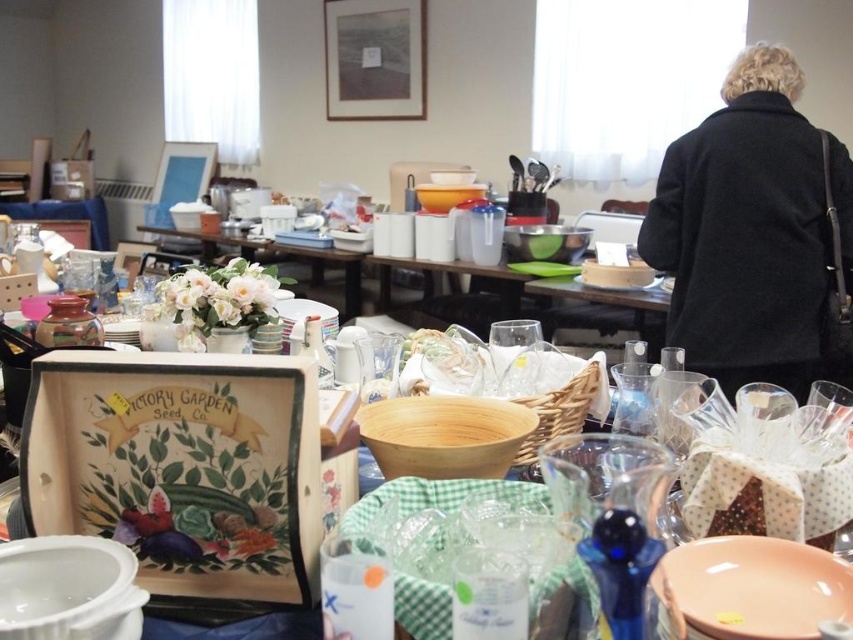
Is black wool coat at upper right taller than white porcelain vase at center?

Correct, black wool coat at upper right is much taller as white porcelain vase at center.

Is black wool coat at upper right positioned at the back of white porcelain vase at center?

No, it is not.

Locate an element on the screen. black wool coat at upper right is located at coordinates (750, 230).

Does black wool coat at upper right have a greater height compared to matte white plate at center?

Indeed, black wool coat at upper right has a greater height compared to matte white plate at center.

Who is lower down, black wool coat at upper right or matte white plate at center?

matte white plate at center is below.

The height and width of the screenshot is (640, 853). Identify the location of black wool coat at upper right. (750, 230).

Does white porcelain vase at center have a lesser width compared to matte white plate at center?

Incorrect, white porcelain vase at center's width is not less than matte white plate at center's.

This screenshot has height=640, width=853. I want to click on white porcelain vase at center, so (283, 257).